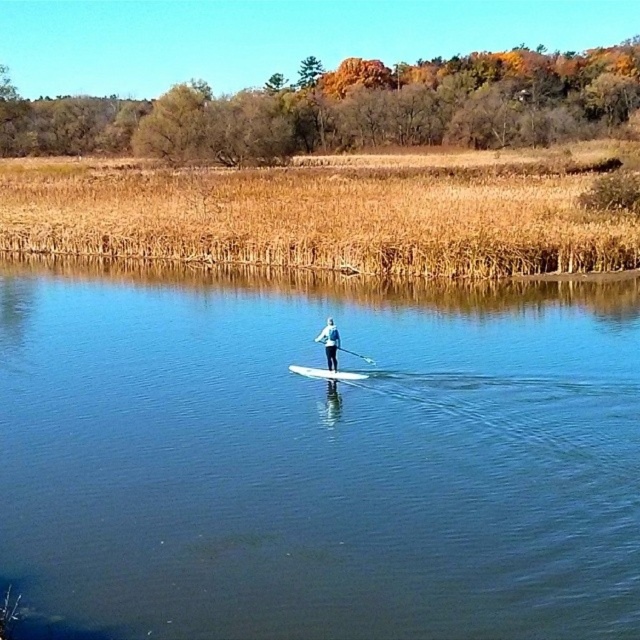
Question: Does white matte paddleboard at center appear on the left side of white foam surfboard at center?

Choices:
 (A) yes
 (B) no

Answer: (B)

Question: Is white matte paddleboard at center closer to the viewer compared to white glossy paddle at center?

Choices:
 (A) yes
 (B) no

Answer: (A)

Question: Which of the following is the farthest from the observer?

Choices:
 (A) dry grass at upper center
 (B) white glossy paddle at center
 (C) clear blue water at center

Answer: (A)

Question: Which of the following is the farthest from the observer?

Choices:
 (A) white foam surfboard at center
 (B) white matte paddleboard at center
 (C) white glossy paddle at center

Answer: (A)

Question: Can you confirm if dry grass at upper center is smaller than white matte paddleboard at center?

Choices:
 (A) no
 (B) yes

Answer: (A)

Question: Which object appears farthest from the camera in this image?

Choices:
 (A) white glossy paddle at center
 (B) white matte paddleboard at center

Answer: (A)